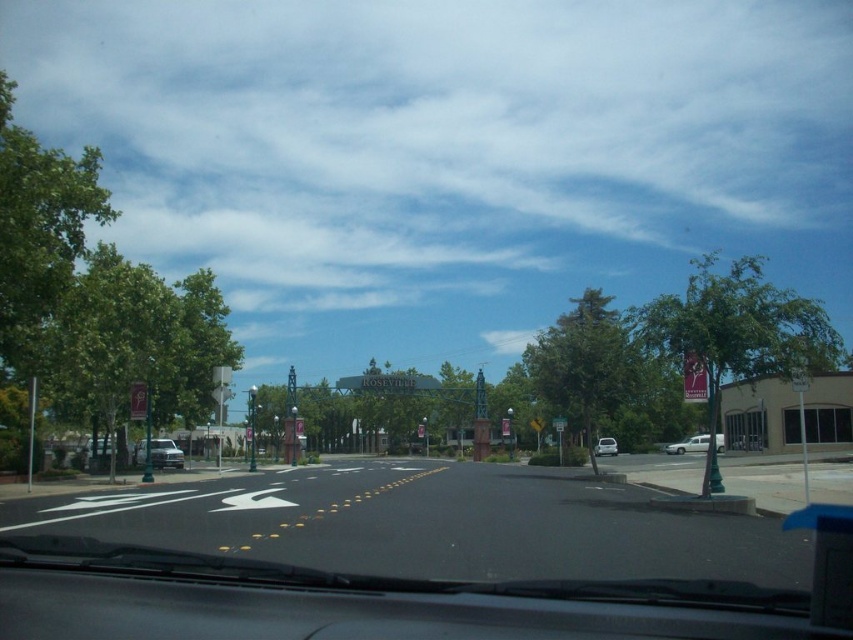
Question: Which of the following is the farthest from the observer?

Choices:
 (A) (614, 449)
 (B) (691, 436)

Answer: (B)

Question: Observing the image, what is the correct spatial positioning of silver metallic truck at center in reference to white glossy sedan at center?

Choices:
 (A) left
 (B) right

Answer: (A)

Question: Can you confirm if silver metallic truck at center is positioned to the left of white glossy van at center-right?

Choices:
 (A) yes
 (B) no

Answer: (A)

Question: Among these objects, which one is farthest from the camera?

Choices:
 (A) silver metallic truck at center
 (B) white glossy sedan at center

Answer: (B)

Question: Is white glossy van at center-right to the left of white glossy sedan at center from the viewer's perspective?

Choices:
 (A) yes
 (B) no

Answer: (B)

Question: Which of the following is the farthest from the observer?

Choices:
 (A) white glossy van at center-right
 (B) silver metallic truck at center
 (C) white glossy sedan at center

Answer: (C)